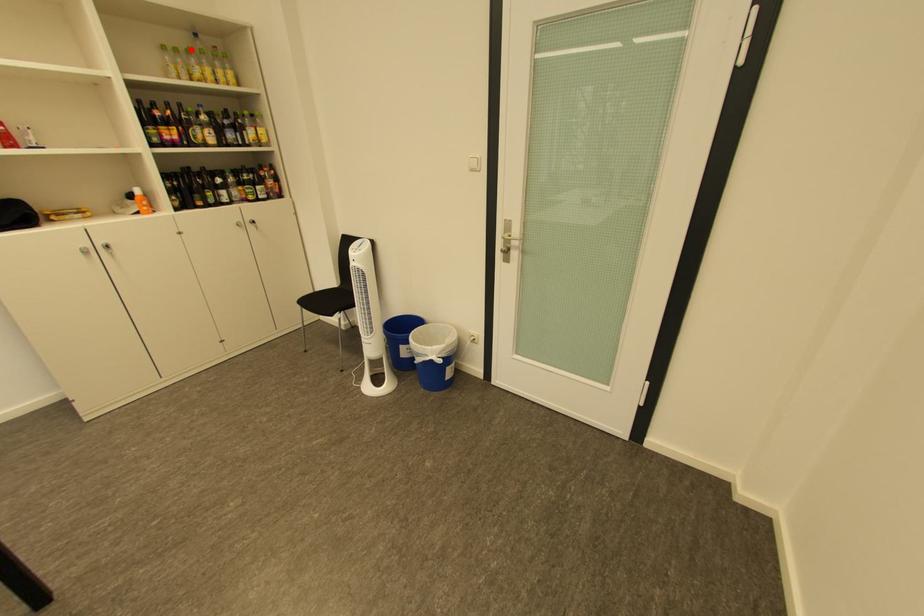
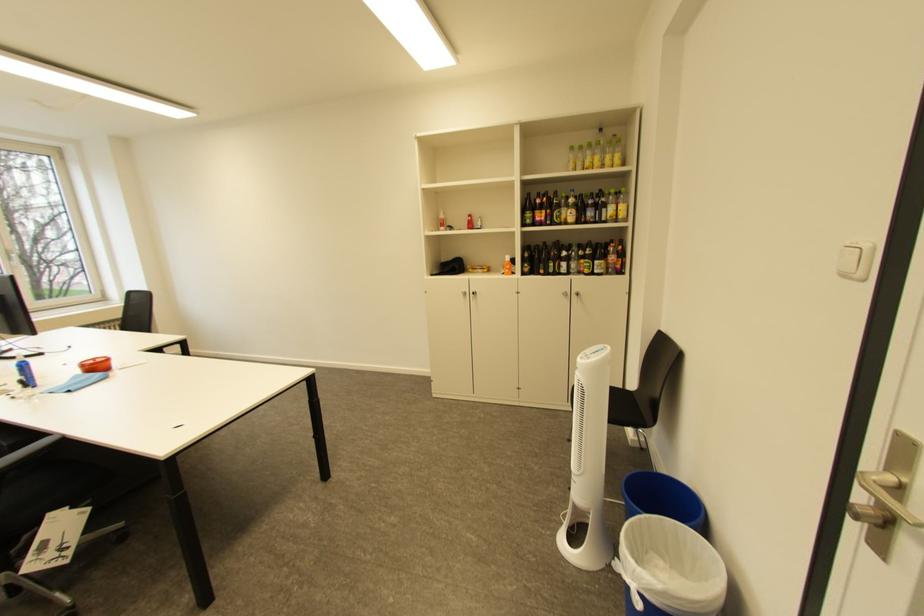
Where in the second image is the point corresponding to the highlighted location from the first image?

(596, 146)